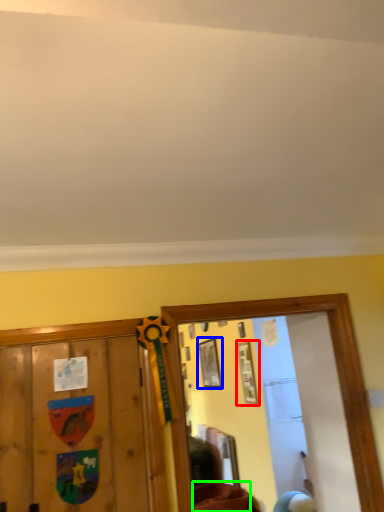
Question: Based on their relative distances, which object is nearer to picture frame (highlighted by a red box)? Choose from picture frame (highlighted by a blue box) and furniture (highlighted by a green box).

Choices:
 (A) picture frame
 (B) furniture

Answer: (A)